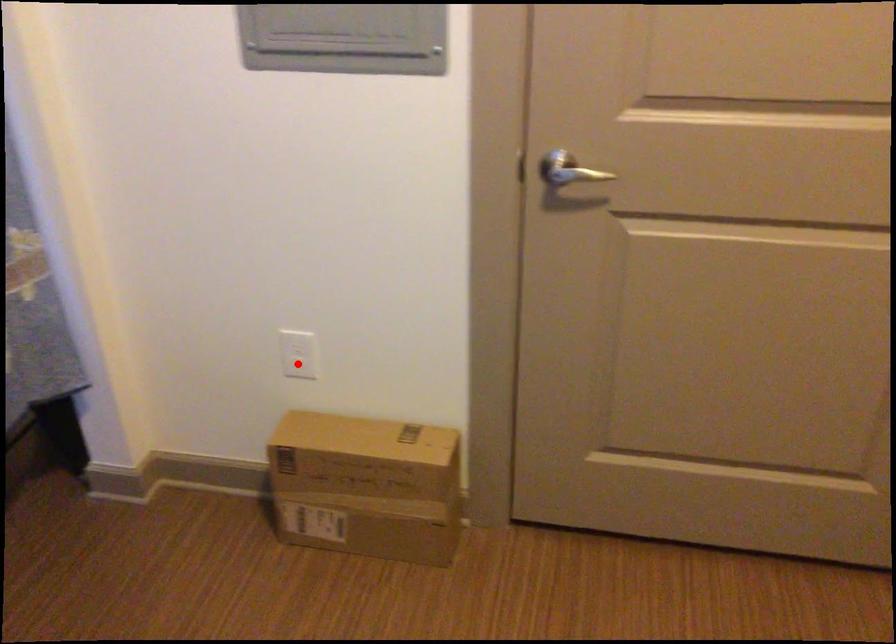
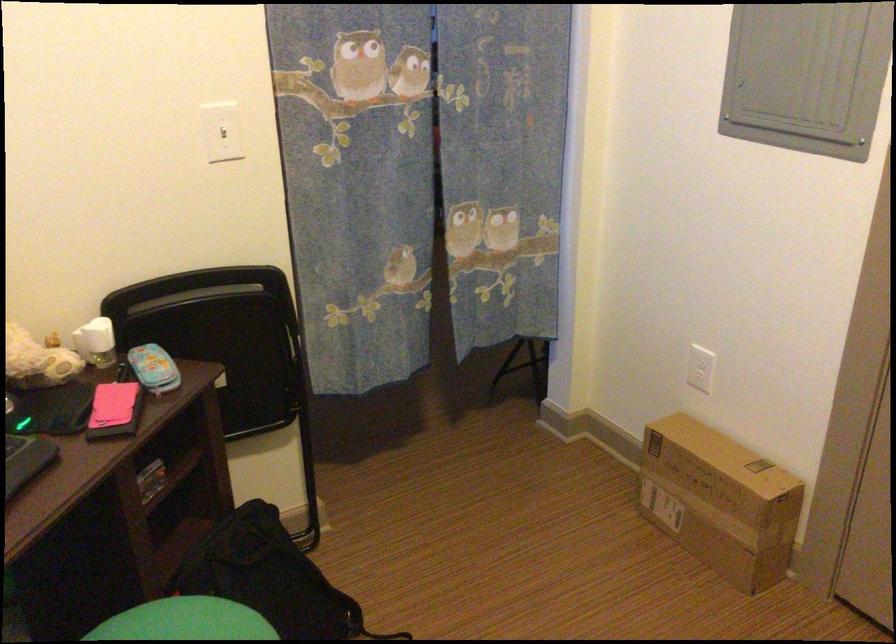
Question: I am providing you with two images of the same scene from different viewpoints. Image1 has a red point marked. In image2, the corresponding 3D location appears at what relative position? Reply with the corresponding letter.

Choices:
 (A) Closer
 (B) Farther

Answer: (B)